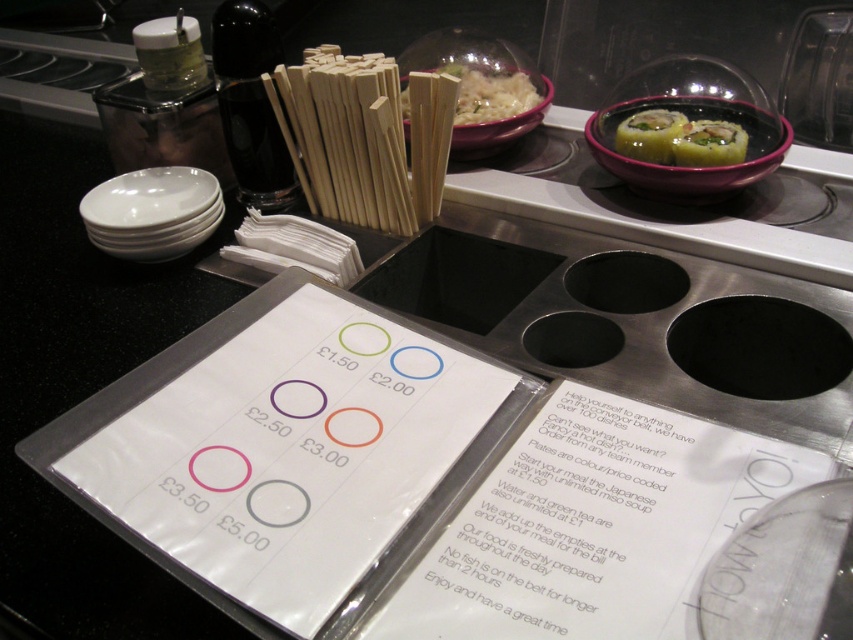
Can you confirm if wooden chopsticks at center is positioned below green matte sushi at upper right?

Actually, wooden chopsticks at center is above green matte sushi at upper right.

Who is positioned more to the right, wooden chopsticks at center or green matte sushi at upper right?

green matte sushi at upper right

Between point (323, 157) and point (694, 166), which one is positioned behind?

The point (323, 157) is behind.

Where is `wooden chopsticks at center`? The width and height of the screenshot is (853, 640). wooden chopsticks at center is located at coordinates (364, 138).

Which is above, green leafy sushi at upper right or green matte sushi at upper right?

green leafy sushi at upper right

Is point (676, 120) in front of point (732, 156)?

No, it is not.

Identify the location of green leafy sushi at upper right. (654, 138).

Can you confirm if white paper menu at center is taller than wooden chopsticks at center?

No, white paper menu at center is not taller than wooden chopsticks at center.

Does white paper menu at center have a lesser width compared to wooden chopsticks at center?

In fact, white paper menu at center might be wider than wooden chopsticks at center.

Is point (764, 477) farther from camera compared to point (445, 148)?

That is False.

You are a GUI agent. You are given a task and a screenshot of the screen. Output one action in this format:
    pyautogui.click(x=<x>, y=<y>)
    Task: Click on the white paper menu at center
    The width and height of the screenshot is (853, 640).
    Given the screenshot: What is the action you would take?
    pyautogui.click(x=593, y=525)